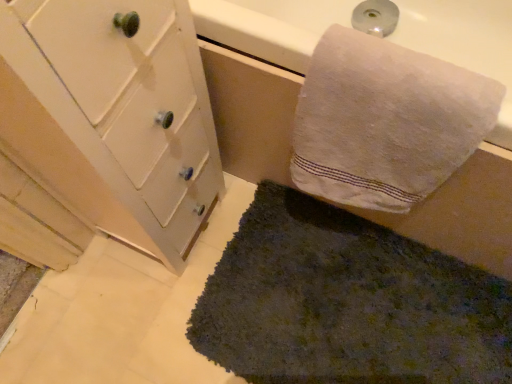
Locate an element on the screen. This screenshot has height=384, width=512. free space in front of white painted wood cabinet at left is located at coordinates (142, 310).